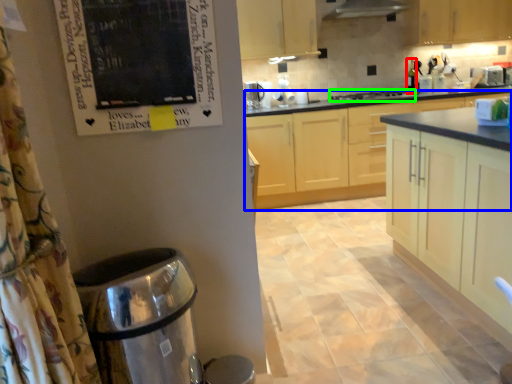
Question: Which object is positioned closest to bottle (highlighted by a red box)? Select from cabinetry (highlighted by a blue box) and home appliance (highlighted by a green box).

Choices:
 (A) cabinetry
 (B) home appliance

Answer: (B)